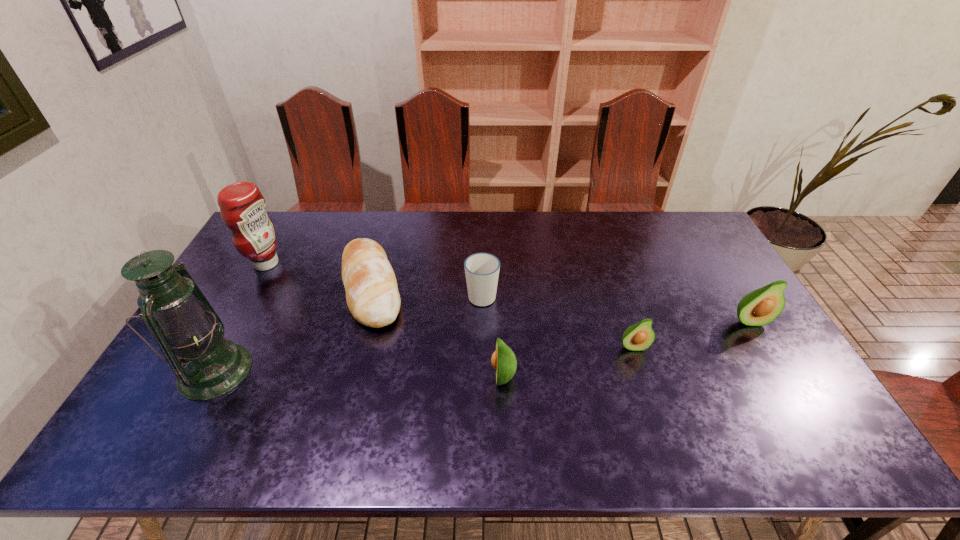
Identify the location of the leftmost avocado. This screenshot has height=540, width=960. (503, 360).

This screenshot has height=540, width=960. In order to click on the nearest avocado in this screenshot , I will do `click(503, 360)`.

Locate an element on the screen. the second object from right to left is located at coordinates (640, 336).

The width and height of the screenshot is (960, 540). Identify the location of the shortest avocado. (640, 336).

This screenshot has width=960, height=540. I want to click on the rightmost object, so click(760, 307).

The width and height of the screenshot is (960, 540). Identify the location of the farthest avocado. (760, 307).

Image resolution: width=960 pixels, height=540 pixels. In order to click on cup in this screenshot , I will do `click(481, 269)`.

Where is `condiment`? This screenshot has height=540, width=960. condiment is located at coordinates (242, 207).

At what (x,y) coordinates should I click in order to perform the action: click on oil lamp. Please return your answer as a coordinate pair (x, y). The width and height of the screenshot is (960, 540). Looking at the image, I should click on (184, 324).

Identify the location of the third object from left to right. This screenshot has height=540, width=960. pos(372,295).